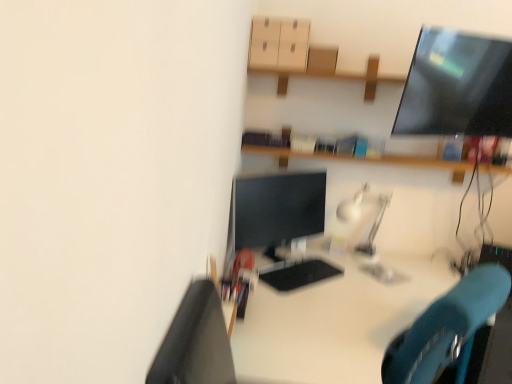
Question: Is satin silver lamp at center in front of or behind white glossy desk at center in the image?

Choices:
 (A) front
 (B) behind

Answer: (B)

Question: In terms of size, does satin silver lamp at center appear bigger or smaller than white glossy desk at center?

Choices:
 (A) big
 (B) small

Answer: (B)

Question: Estimate the real-world distances between objects in this image. Which object is closer to the matte black monitor at center?

Choices:
 (A) matte cardboard drawer at upper center
 (B) white glossy desk at center
 (C) satin silver lamp at center

Answer: (C)

Question: Estimate the real-world distances between objects in this image. Which object is closer to the matte cardboard drawer at upper center?

Choices:
 (A) white glossy desk at center
 (B) matte black monitor at center
 (C) satin silver lamp at center

Answer: (B)